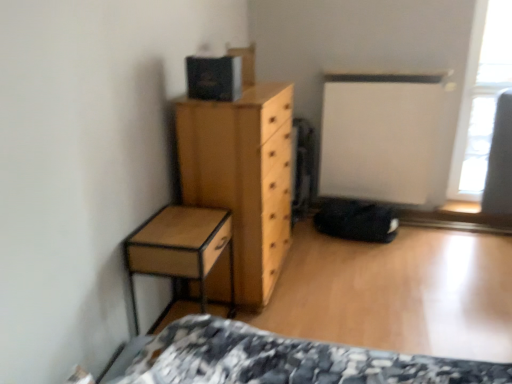
Measure the distance between point (463, 175) and camera.

A: The distance of point (463, 175) from camera is 3.54 meters.

Image resolution: width=512 pixels, height=384 pixels. Find the location of `wooden nightstand at left`. wooden nightstand at left is located at coordinates (180, 248).

Is light brown wood chest of drawers at center looking in the opposite direction of wooden nightstand at left?

No, wooden nightstand at left is not at the back of light brown wood chest of drawers at center.

From a real-world perspective, is light brown wood chest of drawers at center physically above wooden nightstand at left?

Yes, from a real-world perspective, light brown wood chest of drawers at center is above wooden nightstand at left.

Considering the relative sizes of light brown wood chest of drawers at center and wooden nightstand at left in the image provided, is light brown wood chest of drawers at center smaller than wooden nightstand at left?

No, light brown wood chest of drawers at center is not smaller than wooden nightstand at left.

From the image's perspective, which is above, light brown wood chest of drawers at center or wooden nightstand at left?

light brown wood chest of drawers at center.

Is transparent glass window at upper right not near light brown wood chest of drawers at center?

Yes, transparent glass window at upper right and light brown wood chest of drawers at center are located far from each other.

Between transparent glass window at upper right and light brown wood chest of drawers at center, which one has less height?

With less height is light brown wood chest of drawers at center.

Between transparent glass window at upper right and light brown wood chest of drawers at center, which one appears on the right side from the viewer's perspective?

transparent glass window at upper right is more to the right.

How different are the orientations of transparent glass window at upper right and light brown wood chest of drawers at center in degrees?

There is a 90.6-degree angle between the facing directions of transparent glass window at upper right and light brown wood chest of drawers at center.

Does point (202, 154) appear closer or farther from the camera than point (478, 169)?

Point (202, 154) is positioned closer to the camera compared to point (478, 169).

Does light brown wood chest of drawers at center have a lesser width compared to transparent glass window at upper right?

No, light brown wood chest of drawers at center is not thinner than transparent glass window at upper right.

Locate an element on the screen. This screenshot has width=512, height=384. window screen that is behind the light brown wood chest of drawers at center is located at coordinates (481, 97).

From a real-world perspective, is light brown wood chest of drawers at center on transparent glass window at upper right?

No, from a real-world perspective, light brown wood chest of drawers at center is not on top of transparent glass window at upper right.

Is point (139, 236) positioned after point (487, 2)?

No, it is in front of (487, 2).

Between wooden nightstand at left and transparent glass window at upper right, which one has less height?

Standing shorter between the two is wooden nightstand at left.

From a real-world perspective, between wooden nightstand at left and transparent glass window at upper right, who is vertically higher?

transparent glass window at upper right.

Could you tell me if wooden nightstand at left is turned towards transparent glass window at upper right?

No, wooden nightstand at left is not facing towards transparent glass window at upper right.

Could you tell me if wooden nightstand at left is turned towards light brown wood chest of drawers at center?

No, wooden nightstand at left does not turn towards light brown wood chest of drawers at center.

Considering the points (172, 210) and (190, 188), which point is in front, point (172, 210) or point (190, 188)?

The point (172, 210) is closer to the camera.

Would you consider wooden nightstand at left to be distant from light brown wood chest of drawers at center?

They are positioned close to each other.

Is transparent glass window at upper right smaller than wooden nightstand at left?

Yes.

Does point (468, 94) come in front of point (179, 210)?

No, it is behind (179, 210).

From the picture: Is transparent glass window at upper right placed right next to wooden nightstand at left?

No, transparent glass window at upper right is not beside wooden nightstand at left.

Looking at this image, from a real-world perspective, is transparent glass window at upper right positioned above or below wooden nightstand at left?

Clearly, from a real-world perspective, transparent glass window at upper right is above wooden nightstand at left.

The width and height of the screenshot is (512, 384). Find the location of `nightstand located in front of the light brown wood chest of drawers at center`. nightstand located in front of the light brown wood chest of drawers at center is located at coordinates (180, 248).

Find the location of a particular element. the chest of drawers below the transparent glass window at upper right (from a real-world perspective) is located at coordinates [x=243, y=177].

Estimate the real-world distances between objects in this image. Which object is further from wooden nightstand at left, transparent glass window at upper right or light brown wood chest of drawers at center?

The object further to wooden nightstand at left is transparent glass window at upper right.

Considering their positions, is light brown wood chest of drawers at center positioned further to wooden nightstand at left than transparent glass window at upper right?

transparent glass window at upper right lies further to wooden nightstand at left than the other object.

From the image, which object appears to be farther from light brown wood chest of drawers at center, wooden nightstand at left or transparent glass window at upper right?

Based on the image, transparent glass window at upper right appears to be further to light brown wood chest of drawers at center.

Considering their positions, is wooden nightstand at left positioned further to transparent glass window at upper right than light brown wood chest of drawers at center?

wooden nightstand at left is further to transparent glass window at upper right.

When comparing their distances from transparent glass window at upper right, does light brown wood chest of drawers at center or wooden nightstand at left seem closer?

light brown wood chest of drawers at center is closer to transparent glass window at upper right.

From the picture: Estimate the real-world distances between objects in this image. Which object is closer to light brown wood chest of drawers at center, transparent glass window at upper right or wooden nightstand at left?

wooden nightstand at left is positioned closer to the anchor light brown wood chest of drawers at center.

The height and width of the screenshot is (384, 512). In order to click on chest of drawers between wooden nightstand at left and transparent glass window at upper right from left to right in this screenshot , I will do `click(243, 177)`.